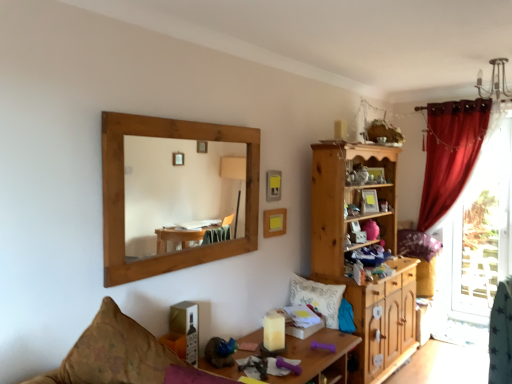
What do you see at coordinates (274, 222) in the screenshot?
I see `yellow matte picture frame at upper center, placed as the second picture frame when sorted from top to bottom` at bounding box center [274, 222].

Where is `yellow matte picture frame at upper center, placed as the second picture frame when sorted from top to bottom`? This screenshot has width=512, height=384. yellow matte picture frame at upper center, placed as the second picture frame when sorted from top to bottom is located at coordinates (274, 222).

What do you see at coordinates (175, 189) in the screenshot? I see `wooden mirror at upper left` at bounding box center [175, 189].

What do you see at coordinates (123, 356) in the screenshot? I see `patterned fabric couch at lower left` at bounding box center [123, 356].

This screenshot has width=512, height=384. I want to click on fluffy purple pillow at right, which is counted as the first pillow, starting from the top, so click(x=417, y=244).

Identify the location of matte yellow picture frame at upper center, the first picture frame in the top-to-bottom sequence. The width and height of the screenshot is (512, 384). (273, 185).

Identify the location of yellow matte picture frame at upper center, placed as the second picture frame when sorted from top to bottom. (274, 222).

Does white mesh screen at right have a lesser width compared to wooden cabinet at center-right?

Indeed, white mesh screen at right has a lesser width compared to wooden cabinet at center-right.

Can you confirm if white mesh screen at right is bigger than wooden cabinet at center-right?

No, white mesh screen at right is not bigger than wooden cabinet at center-right.

From the picture: What's the angular difference between white mesh screen at right and wooden cabinet at center-right's facing directions?

white mesh screen at right and wooden cabinet at center-right are facing 91.5 degrees away from each other.

From the image's perspective, between white mesh screen at right and wooden cabinet at center-right, who is located below?

wooden cabinet at center-right is shown below in the image.

Consider the image. Is wooden cabinet at center-right inside patterned fabric couch at lower left?

No, wooden cabinet at center-right is not inside patterned fabric couch at lower left.

Can you confirm if patterned fabric couch at lower left is taller than wooden cabinet at center-right?

In fact, patterned fabric couch at lower left may be shorter than wooden cabinet at center-right.

Can you confirm if patterned fabric couch at lower left is positioned to the right of wooden cabinet at center-right?

No.

Consider the image. Which is more to the left, patterned fabric couch at lower left or wooden mirror at upper left?

From the viewer's perspective, patterned fabric couch at lower left appears more on the left side.

From the image's perspective, which one is positioned higher, patterned fabric couch at lower left or wooden mirror at upper left?

wooden mirror at upper left.

From a real-world perspective, relative to wooden mirror at upper left, is patterned fabric couch at lower left vertically above or below?

patterned fabric couch at lower left is below wooden mirror at upper left.

In terms of size, does patterned fabric couch at lower left appear bigger or smaller than wooden mirror at upper left?

In the image, patterned fabric couch at lower left appears to be larger than wooden mirror at upper left.

From the picture: Which of these two, wooden mirror at upper left or patterned fabric couch at lower left, is wider?

patterned fabric couch at lower left is wider.

Between wooden mirror at upper left and patterned fabric couch at lower left, which one appears on the right side from the viewer's perspective?

wooden mirror at upper left.

From a real-world perspective, does wooden mirror at upper left sit lower than patterned fabric couch at lower left?

No, from a real-world perspective, wooden mirror at upper left is not under patterned fabric couch at lower left.

Consider the image. Is wooden mirror at upper left smaller than patterned fabric couch at lower left?

Yes.

Between wooden mirror at upper left and wooden desk at center, which one appears on the right side from the viewer's perspective?

wooden desk at center is more to the right.

Which object is further away from the camera, wooden mirror at upper left or wooden desk at center?

Positioned behind is wooden desk at center.

Who is shorter, wooden mirror at upper left or wooden desk at center?

With less height is wooden desk at center.

From a real-world perspective, between wooden mirror at upper left and wooden desk at center, who is vertically lower?

wooden desk at center, from a real-world perspective.

The width and height of the screenshot is (512, 384). Find the location of `window screen behind the wooden desk at center`. window screen behind the wooden desk at center is located at coordinates (482, 231).

Does wooden desk at center have a greater height compared to white mesh screen at right?

No.

Is wooden desk at center next to white mesh screen at right?

Answer: No, wooden desk at center is not next to white mesh screen at right.

Is wooden desk at center spatially inside white mesh screen at right, or outside of it?

A: wooden desk at center cannot be found inside white mesh screen at right.

Which is less distant, (272, 189) or (472, 299)?

Point (272, 189) is positioned closer to the camera compared to point (472, 299).

Can you see matte yellow picture frame at upper center, which appears as the second picture frame when ordered from the bottom, touching white mesh screen at right?

No, matte yellow picture frame at upper center, which appears as the second picture frame when ordered from the bottom, is not next to white mesh screen at right.

Can you confirm if matte yellow picture frame at upper center, the first picture frame in the top-to-bottom sequence, is bigger than white mesh screen at right?

Incorrect, matte yellow picture frame at upper center, the first picture frame in the top-to-bottom sequence, is not larger than white mesh screen at right.

Based on the photo, between matte yellow picture frame at upper center, the first picture frame in the top-to-bottom sequence, and white mesh screen at right, which one has more height?

white mesh screen at right.

Identify the location of window screen above the wooden cabinet at center-right (from a real-world perspective). (482, 231).

In the image, there is a patterned fabric couch at lower left. Where is `cabinetry above it (from the image's perspective)`? The height and width of the screenshot is (384, 512). cabinetry above it (from the image's perspective) is located at coordinates (358, 250).

Based on the photo, estimate the real-world distances between objects in this image. Which object is further from fluffy purple pillow at right, which is the second pillow in left-to-right order, wooden mirror at upper left or white mesh screen at right?

wooden mirror at upper left.

Based on their spatial positions, is wooden mirror at upper left or patterned fabric couch at lower left further from white mesh screen at right?

The object further to white mesh screen at right is patterned fabric couch at lower left.

Considering their positions, is white mesh screen at right positioned further to white textured pillow at center, the first pillow in the front-to-back sequence, than fluffy purple pillow at right, the second pillow in the front-to-back sequence?

The object further to white textured pillow at center, the first pillow in the front-to-back sequence, is white mesh screen at right.

When comparing their distances from wooden desk at center, does yellow matte picture frame at upper center, placed as the second picture frame when sorted from top to bottom, or wooden cabinet at center-right seem closer?

The object closer to wooden desk at center is wooden cabinet at center-right.

Considering their positions, is wooden mirror at upper left positioned closer to white mesh screen at right than matte yellow picture frame at upper center, the first picture frame in the top-to-bottom sequence?

matte yellow picture frame at upper center, the first picture frame in the top-to-bottom sequence, lies closer to white mesh screen at right than the other object.

Looking at the image, which one is located closer to wooden cabinet at center-right, matte yellow picture frame at upper center, the first picture frame in the top-to-bottom sequence, or wooden mirror at upper left?

Among the two, matte yellow picture frame at upper center, the first picture frame in the top-to-bottom sequence, is located nearer to wooden cabinet at center-right.

Based on their spatial positions, is wooden desk at center or wooden mirror at upper left closer to matte yellow picture frame at upper center, which appears as the second picture frame when ordered from the bottom?

wooden desk at center lies closer to matte yellow picture frame at upper center, which appears as the second picture frame when ordered from the bottom, than the other object.

When comparing their distances from white mesh screen at right, does wooden mirror at upper left or yellow matte picture frame at upper center, placed as the second picture frame when sorted from top to bottom, seem closer?

yellow matte picture frame at upper center, placed as the second picture frame when sorted from top to bottom, is positioned closer to the anchor white mesh screen at right.

Locate an element on the screen. pillow positioned between wooden cabinet at center-right and fluffy purple pillow at right, the first pillow viewed from the back, from near to far is located at coordinates (317, 298).

Where is `picture frame between wooden desk at center and white mesh screen at right`? The image size is (512, 384). picture frame between wooden desk at center and white mesh screen at right is located at coordinates (274, 222).

The width and height of the screenshot is (512, 384). Find the location of `pillow located between wooden cabinet at center-right and white mesh screen at right in the left-right direction`. pillow located between wooden cabinet at center-right and white mesh screen at right in the left-right direction is located at coordinates (417, 244).

Find the location of `pillow located between wooden desk at center and fluffy purple pillow at right, the first pillow viewed from the back, in the depth direction`. pillow located between wooden desk at center and fluffy purple pillow at right, the first pillow viewed from the back, in the depth direction is located at coordinates point(317,298).